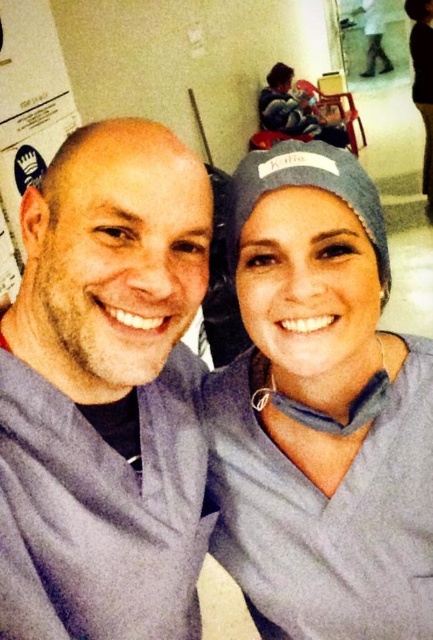
How far apart are matte gray scrub at center and gray fabric cap at upper center?

matte gray scrub at center is 3.96 meters from gray fabric cap at upper center.

Who is more forward, (278, 224) or (425, 113)?

Positioned in front is point (278, 224).

Which is in front, point (355, 212) or point (426, 132)?

Point (355, 212)

What are the coordinates of `matte gray scrub at center` in the screenshot? It's located at (320, 412).

Between point (138, 211) and point (345, 504), which one is positioned in front?

Point (138, 211) is more forward.

Is gray matte scrubs at left positioned behind matte gray scrub at center?

No, gray matte scrubs at left is in front of matte gray scrub at center.

Describe the element at coordinates (106, 394) in the screenshot. I see `gray matte scrubs at left` at that location.

You are a GUI agent. You are given a task and a screenshot of the screen. Output one action in this format:
    pyautogui.click(x=<x>, y=<y>)
    Task: Click on the gray matte scrubs at left
    This screenshot has height=640, width=433.
    Given the screenshot: What is the action you would take?
    pyautogui.click(x=106, y=394)

Can you confirm if gray matte scrubs at left is thinner than gray fabric cap at upper center?

Yes, gray matte scrubs at left is thinner than gray fabric cap at upper center.

At what (x,y) coordinates should I click in order to perform the action: click on gray matte scrubs at left. Please return your answer as a coordinate pair (x, y). This screenshot has height=640, width=433. Looking at the image, I should click on (106, 394).